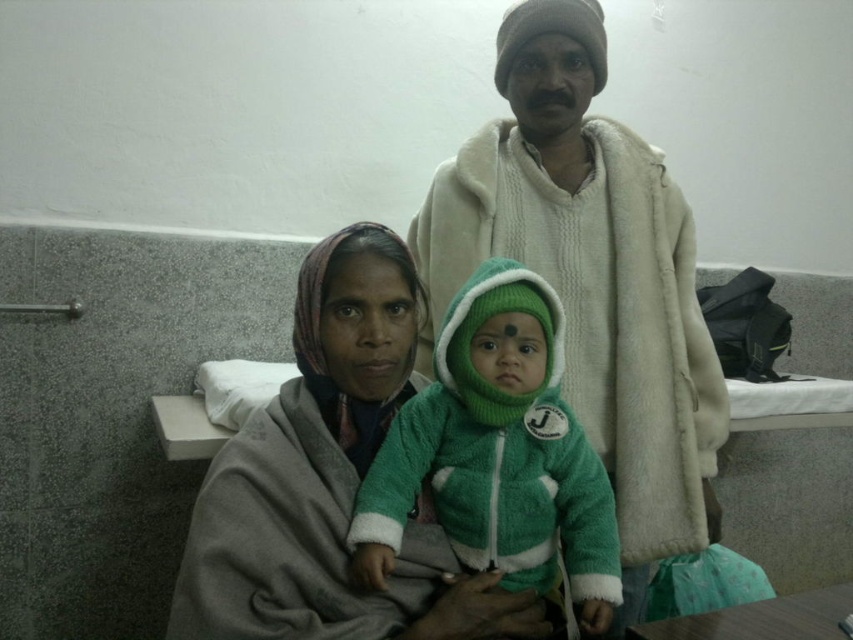
You are a photographer trying to capture a closeup of the baby in the image. You need to adjust your camera to focus on the baby without the gray woolen shawl at center overlapping the green fuzzy jacket at center. Is the shawl large enough to potentially cover the jacket if not positioned carefully?

The gray woolen shawl at center is bigger than the green fuzzy jacket at center, so yes, it is large enough to potentially cover the jacket if not positioned carefully.

You are a nurse in a hospital room and need to cover both the white fuzzy coat at upper center and the gray woolen shawl at center to keep them warm. Which item requires a larger covering material?

The white fuzzy coat at upper center requires a larger covering material because it is larger in size than the gray woolen shawl at center.